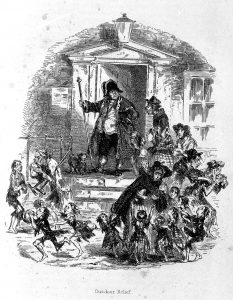
Image resolution: width=233 pixels, height=300 pixels. What are the coordinates of `stairs` in the screenshot? It's located at (101, 183), (102, 193), (96, 205).